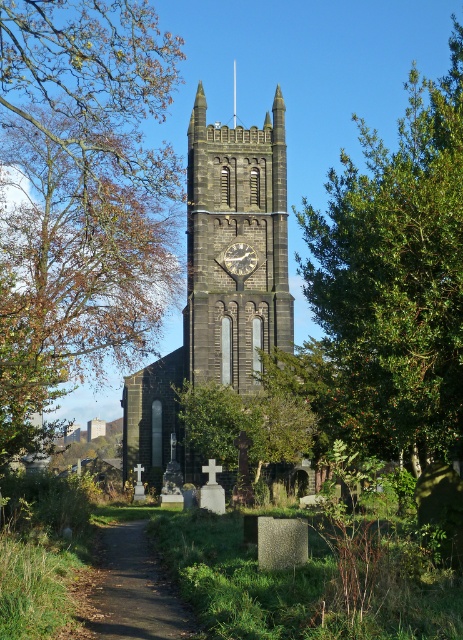
You are standing at the base of the Gothic church tower and want to take a photo of the green leafy tree at upper right. Which direction should you face to ensure the tree is in the frame?

The green leafy tree at upper right is located at point coordinates, so you should face towards the upper right direction to include it in your photo.

You are a photographer planning to capture a wide shot of the dark gray stone clock tower at center and the green leafy tree at upper right. Given their widths, which object will appear wider in the photo?

The green leafy tree at upper right will appear wider in the photo because its width surpasses that of the dark gray stone clock tower at center.